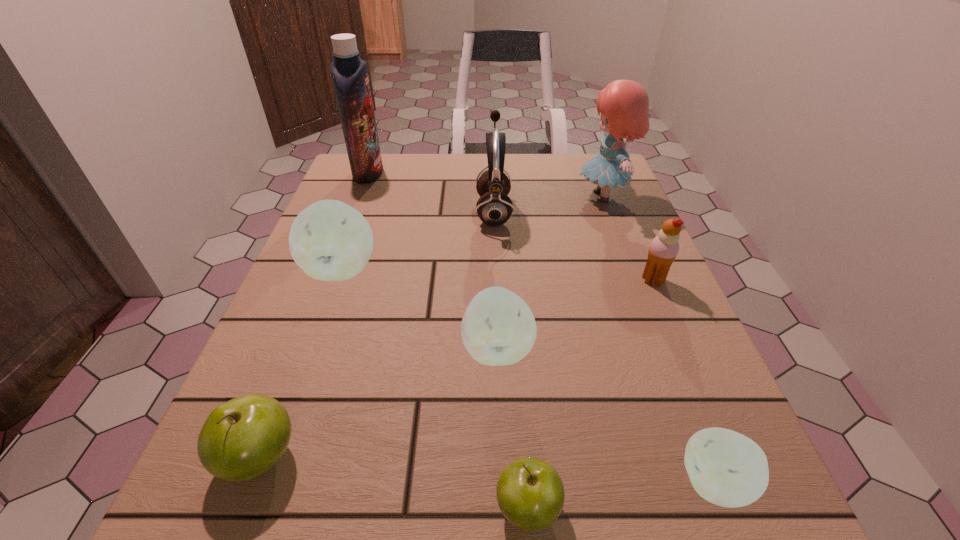
Where is `vacant space that's between the bigger green apple and the farthest white apple`? This screenshot has height=540, width=960. vacant space that's between the bigger green apple and the farthest white apple is located at coordinates (301, 363).

This screenshot has width=960, height=540. What are the coordinates of `vacant area between the rightmost white apple and the farthest white apple` in the screenshot? It's located at (528, 376).

Where is `free spot between the eighth shortest object and the icecream`? The image size is (960, 540). free spot between the eighth shortest object and the icecream is located at coordinates (628, 238).

Select which object is the fourth closest to the tallest apple. Please provide its 2D coordinates. Your answer should be formatted as a tuple, i.e. [(x, y)], where the tuple contains the x and y coordinates of a point satisfying the conditions above.

[(241, 439)]

Locate which object is the closest to the smallest white apple. Please provide its 2D coordinates. Your answer should be formatted as a tuple, i.e. [(x, y)], where the tuple contains the x and y coordinates of a point satisfying the conditions above.

[(530, 493)]

Identify the location of the fifth closest apple to the brown earphone. (726, 468).

Where is `apple that is the third closest one to the right green apple`? This screenshot has width=960, height=540. apple that is the third closest one to the right green apple is located at coordinates (241, 439).

Choose which white apple is the second nearest neighbor to the farthest white apple. Please provide its 2D coordinates. Your answer should be formatted as a tuple, i.e. [(x, y)], where the tuple contains the x and y coordinates of a point satisfying the conditions above.

[(726, 468)]

Point out which white apple is positioned as the second nearest to the smaller green apple. Please provide its 2D coordinates. Your answer should be formatted as a tuple, i.e. [(x, y)], where the tuple contains the x and y coordinates of a point satisfying the conditions above.

[(726, 468)]

You are a GUI agent. You are given a task and a screenshot of the screen. Output one action in this format:
    pyautogui.click(x=<x>, y=<y>)
    Task: Click on the vacant region that satisfies the following two spatial constraints: 1. on the front label of the farthest white apple; 2. on the left side of the tallest object
    This screenshot has height=540, width=960.
    Given the screenshot: What is the action you would take?
    pyautogui.click(x=331, y=269)